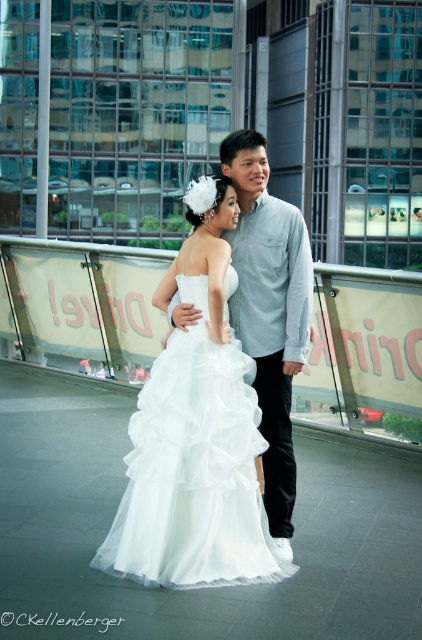
Consider the image. You are planning to seat guests at a narrow table that is 1.2 meters wide. You need to decide if both the white tulle dress at center and the light blue shirt at center can fit side by side without overlapping. Based on their widths, can they both fit?

The white tulle dress at center might be wider than light blue shirt at center. If the dress is wider than 0.6 meters, the total width of both items would exceed 1.2 meters, making it impossible to fit them side by side without overlapping. However, if the dress is exactly 0.6 meters or narrower, they could potentially fit.

You are standing in the urban setting of the image and want to walk from the point at coordinates point (199, 381) to the point at coordinates point (287, 358). Will you have to go forward or backward to reach your destination?

Since point (199, 381) is in front of point (287, 358), you will need to move backward to reach point (287, 358) from point (199, 381).

You are a photographer positioned at the camera. You want to take a photo of the white tulle dress at center. Is the distance between you and the dress sufficient to capture a clear, full body shot without distortion?

The distance between the camera and the white tulle dress at center is 3.51 meters, which is sufficient for a clear, full body shot without distortion.